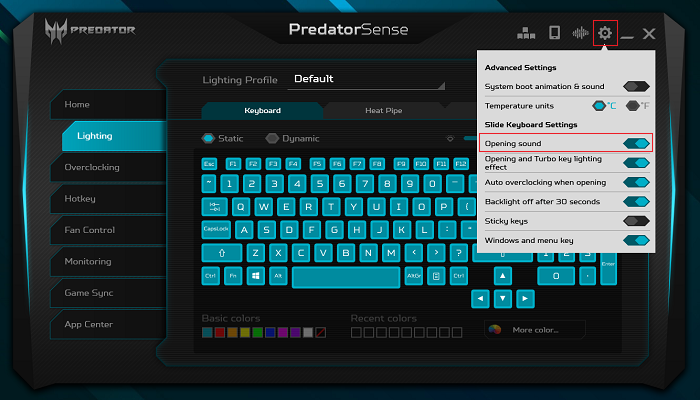
The width and height of the screenshot is (700, 400). In order to click on fan control in this screenshot , I will do `click(98, 233)`.